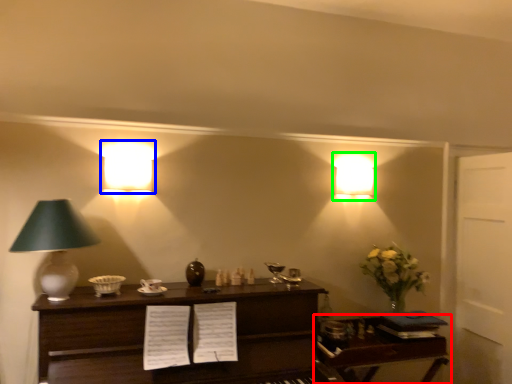
Question: Which is farther away from table (highlighted by a red box)? lamp (highlighted by a blue box) or lamp (highlighted by a green box)?

Choices:
 (A) lamp
 (B) lamp

Answer: (A)